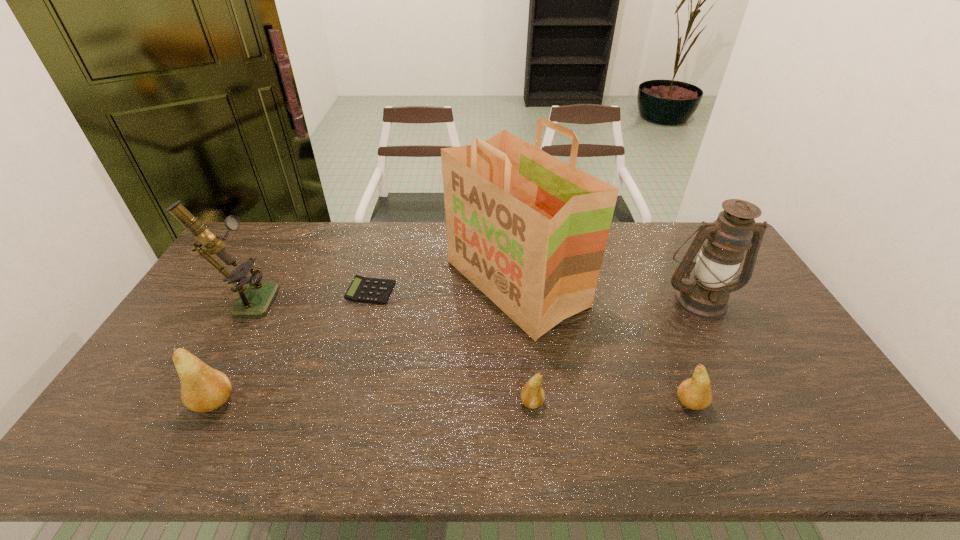
Where is `object that is at the right edge`? The height and width of the screenshot is (540, 960). object that is at the right edge is located at coordinates (705, 295).

I want to click on blank space at the far edge of the desktop, so click(x=649, y=223).

Find the location of `free space at the near edge of the desktop`. free space at the near edge of the desktop is located at coordinates (x=720, y=398).

At what (x,y) coordinates should I click in order to perform the action: click on vacant space at the left edge. Please return your answer as a coordinate pair (x, y). The image size is (960, 540). Looking at the image, I should click on (197, 351).

You are a GUI agent. You are given a task and a screenshot of the screen. Output one action in this format:
    pyautogui.click(x=<x>, y=<y>)
    Task: Click on the vacant space at the right edge of the desktop
    This screenshot has width=960, height=540.
    Given the screenshot: What is the action you would take?
    pyautogui.click(x=743, y=326)

In the image, there is a desktop. Find the location of `vacant space at the near right corner`. vacant space at the near right corner is located at coordinates point(769,391).

Where is `free space between the tallest pear and the second object from right to left`? The width and height of the screenshot is (960, 540). free space between the tallest pear and the second object from right to left is located at coordinates (452, 402).

Locate an element on the screen. This screenshot has height=540, width=960. free space between the fourth shortest object and the shortest pear is located at coordinates click(x=373, y=402).

Image resolution: width=960 pixels, height=540 pixels. I want to click on vacant point located between the microscope and the shortest object, so click(x=309, y=295).

This screenshot has width=960, height=540. In order to click on free spot between the shortest pear and the rightmost object in this screenshot , I will do `click(615, 352)`.